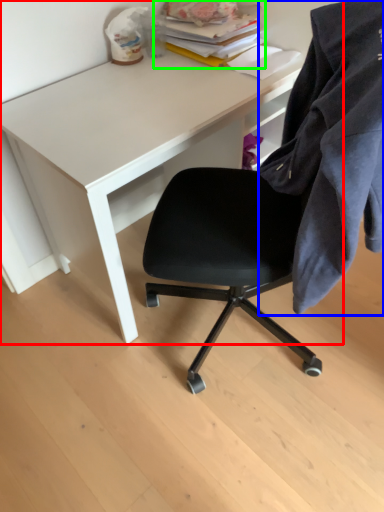
Question: Which object is the farthest from desk (highlighted by a red box)? Choose among these: cloth (highlighted by a blue box) or book (highlighted by a green box).

Choices:
 (A) cloth
 (B) book

Answer: (A)